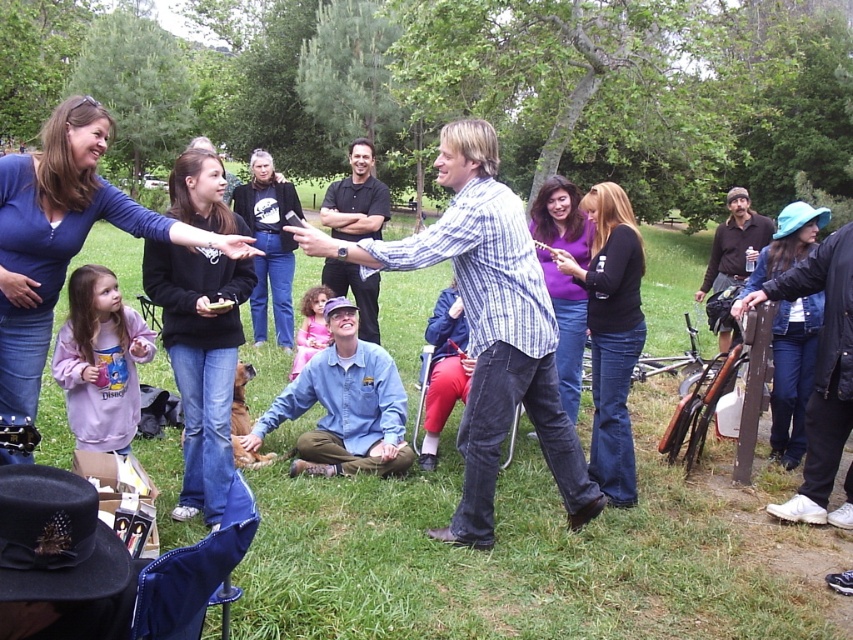
From the picture: Which is above, black denim jeans at center or brown leather jacket at right?

brown leather jacket at right is higher up.

Does black denim jeans at center appear on the left side of brown leather jacket at right?

Correct, you'll find black denim jeans at center to the left of brown leather jacket at right.

Does point (596, 314) lie behind point (720, 269)?

No, (596, 314) is in front of (720, 269).

The width and height of the screenshot is (853, 640). I want to click on black denim jeans at center, so click(611, 332).

How far apart are black cotton shirt at center and brown leather jacket at right?

black cotton shirt at center and brown leather jacket at right are 4.22 meters apart from each other.

Who is more distant from viewer, (271, 227) or (726, 244)?

The point (726, 244) is more distant.

Identify the location of black cotton shirt at center. The image size is (853, 640). (270, 244).

Does point (190, 435) come in front of point (807, 246)?

Yes, it is.

Identify the location of black cotton hoodie at center. Image resolution: width=853 pixels, height=640 pixels. (200, 360).

The image size is (853, 640). In order to click on black cotton hoodie at center in this screenshot , I will do `click(200, 360)`.